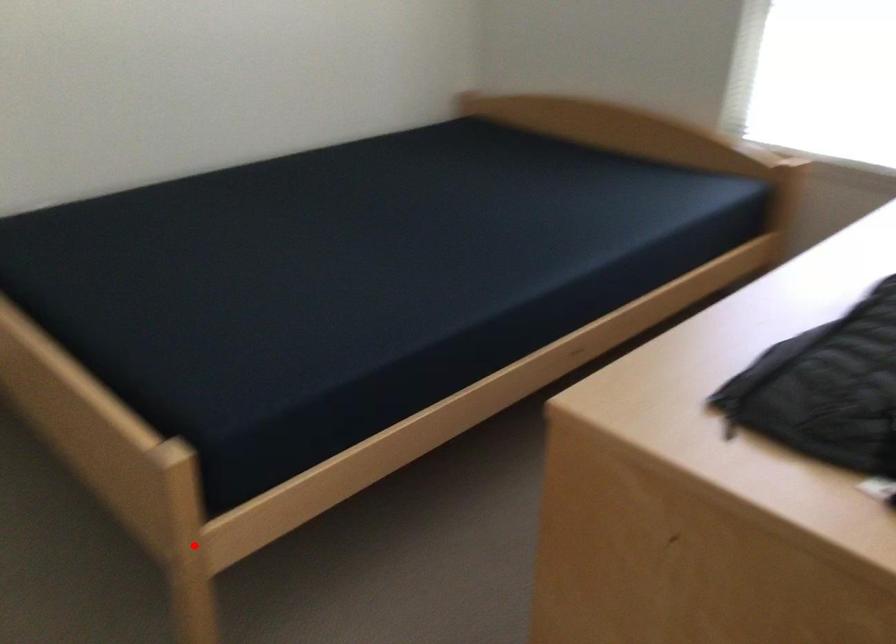
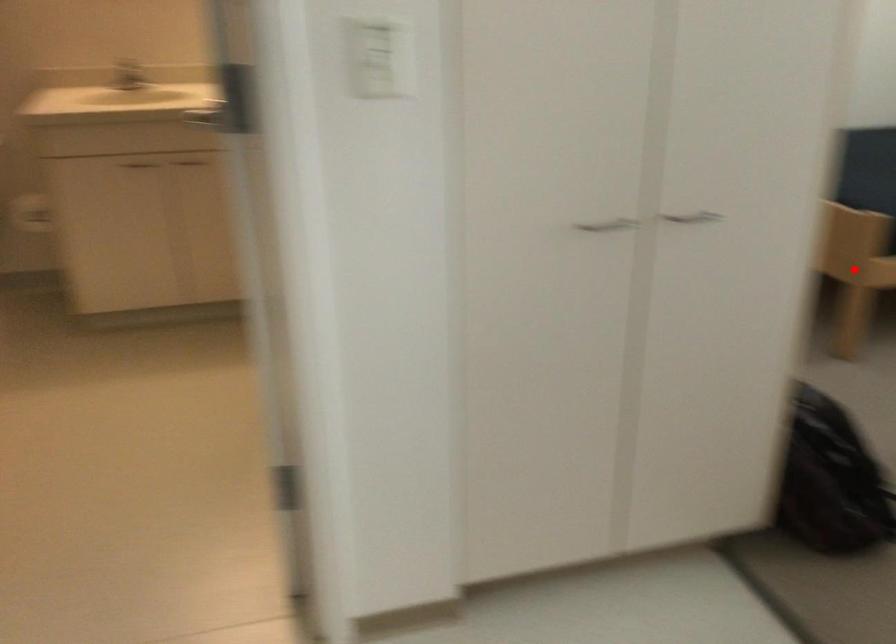
I am providing you with two images of the same scene from different viewpoints. A red point is marked on the first image and another point is marked on the second image. Are the points marked in image1 and image2 representing the same 3D position?

Yes